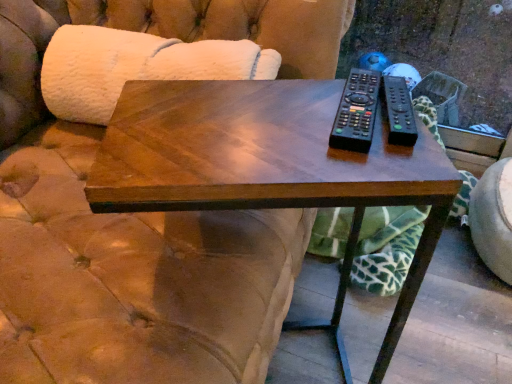
In order to face shiny wood coffee table at center, should I rotate leftwards or rightwards?

A 1.534 degree turn to the right will do.

Where is `black plastic remote at right, marked as the second remote in a left-to-right arrangement`? The image size is (512, 384). black plastic remote at right, marked as the second remote in a left-to-right arrangement is located at coordinates (399, 111).

Where is `shiny wood coffee table at center`? This screenshot has width=512, height=384. shiny wood coffee table at center is located at coordinates (267, 168).

Does black plastic remote at right, marked as the second remote in a left-to-right arrangement, turn towards shiny wood coffee table at center?

No, black plastic remote at right, marked as the second remote in a left-to-right arrangement, is not aimed at shiny wood coffee table at center.

Considering the positions of objects black plastic remote at right, the first remote viewed from the right, and shiny wood coffee table at center in the image provided, who is in front, black plastic remote at right, the first remote viewed from the right, or shiny wood coffee table at center?

shiny wood coffee table at center.

Who is taller, black plastic remote at right, marked as the second remote in a left-to-right arrangement, or shiny wood coffee table at center?

Standing taller between the two is shiny wood coffee table at center.

From the image's perspective, is black plastic remote at right, the first remote viewed from the right, above or below shiny wood coffee table at center?

Based on their image positions, black plastic remote at right, the first remote viewed from the right, is located above shiny wood coffee table at center.

At what (x,y) coordinates should I click in order to perform the action: click on couch located behind the black plastic remote at right, marked as the second remote in a left-to-right arrangement. Please return your answer as a coordinate pair (x, y). Looking at the image, I should click on (164, 36).

Is point (188, 30) positioned before point (385, 99)?

No, (188, 30) is further to viewer.

Between white fluffy couch at upper left and black plastic remote at right, marked as the second remote in a left-to-right arrangement, which one has less height?

With less height is black plastic remote at right, marked as the second remote in a left-to-right arrangement.

Does white fluffy couch at upper left have a lesser width compared to black plastic remote at right, the first remote viewed from the right?

No, white fluffy couch at upper left is not thinner than black plastic remote at right, the first remote viewed from the right.

From the image's perspective, is shiny wood coffee table at center above white fluffy couch at upper left?

No.

Would you consider shiny wood coffee table at center to be distant from white fluffy couch at upper left?

They are positioned close to each other.

Which is correct: shiny wood coffee table at center is inside white fluffy couch at upper left, or outside of it?

shiny wood coffee table at center lies outside white fluffy couch at upper left.

Does point (29, 91) come closer to viewer compared to point (202, 83)?

No.

Considering the relative sizes of white fluffy couch at upper left and shiny wood coffee table at center in the image provided, is white fluffy couch at upper left shorter than shiny wood coffee table at center?

Yes, white fluffy couch at upper left is shorter than shiny wood coffee table at center.

Is white fluffy couch at upper left in front of or behind shiny wood coffee table at center in the image?

Visually, white fluffy couch at upper left is located behind shiny wood coffee table at center.

Is white fluffy couch at upper left next to shiny wood coffee table at center and touching it?

They are not placed beside each other.

From the image's perspective, who appears lower, black plastic remote at upper right, positioned as the second remote in right-to-left order, or white fluffy couch at upper left?

black plastic remote at upper right, positioned as the second remote in right-to-left order, is shown below in the image.

Consider the image. Considering the relative sizes of black plastic remote at upper right, the 1th remote from the left, and white fluffy couch at upper left in the image provided, is black plastic remote at upper right, the 1th remote from the left, smaller than white fluffy couch at upper left?

Yes.

Which object is more forward, black plastic remote at upper right, positioned as the second remote in right-to-left order, or white fluffy couch at upper left?

Positioned in front is black plastic remote at upper right, positioned as the second remote in right-to-left order.

From a real-world perspective, is black plastic remote at upper right, positioned as the second remote in right-to-left order, positioned above or below white fluffy couch at upper left?

Clearly, from a real-world perspective, black plastic remote at upper right, positioned as the second remote in right-to-left order, is above white fluffy couch at upper left.

Is black plastic remote at right, marked as the second remote in a left-to-right arrangement, oriented away from black plastic remote at upper right, the 1th remote from the left?

black plastic remote at right, marked as the second remote in a left-to-right arrangement, is not turned away from black plastic remote at upper right, the 1th remote from the left.

Considering the points (383, 83) and (348, 109), which point is in front, point (383, 83) or point (348, 109)?

The point (348, 109) is closer.

From a real-world perspective, which object stands above the other?

From a 3D spatial view, black plastic remote at right, the first remote viewed from the right, is above.

Would you say black plastic remote at right, the first remote viewed from the right, is a long distance from black plastic remote at upper right, positioned as the second remote in right-to-left order?

No, black plastic remote at right, the first remote viewed from the right, is not far away from black plastic remote at upper right, positioned as the second remote in right-to-left order.

Is black plastic remote at upper right, positioned as the second remote in right-to-left order, spatially inside shiny wood coffee table at center, or outside of it?

black plastic remote at upper right, positioned as the second remote in right-to-left order, is located beyond the bounds of shiny wood coffee table at center.

Considering the sizes of objects black plastic remote at upper right, positioned as the second remote in right-to-left order, and shiny wood coffee table at center in the image provided, who is taller, black plastic remote at upper right, positioned as the second remote in right-to-left order, or shiny wood coffee table at center?

shiny wood coffee table at center is taller.

Considering the positions of objects black plastic remote at upper right, positioned as the second remote in right-to-left order, and shiny wood coffee table at center in the image provided, who is in front, black plastic remote at upper right, positioned as the second remote in right-to-left order, or shiny wood coffee table at center?

shiny wood coffee table at center.

Which remote is the 2nd one when counting from the back of the shiny wood coffee table at center? Please provide its 2D coordinates.

[(399, 111)]

Where is `the 2nd remote positioned below the white fluffy couch at upper left (from the image's perspective)`? Image resolution: width=512 pixels, height=384 pixels. the 2nd remote positioned below the white fluffy couch at upper left (from the image's perspective) is located at coordinates point(399,111).

Considering their positions, is black plastic remote at right, marked as the second remote in a left-to-right arrangement, positioned further to black plastic remote at upper right, the 1th remote from the left, than white fluffy couch at upper left?

white fluffy couch at upper left.

When comparing their distances from white fluffy couch at upper left, does black plastic remote at right, the first remote viewed from the right, or black plastic remote at upper right, positioned as the second remote in right-to-left order, seem further?

Among the two, black plastic remote at right, the first remote viewed from the right, is located further to white fluffy couch at upper left.

Consider the image. When comparing their distances from black plastic remote at right, the first remote viewed from the right, does white fluffy couch at upper left or shiny wood coffee table at center seem further?

white fluffy couch at upper left is further to black plastic remote at right, the first remote viewed from the right.

When comparing their distances from black plastic remote at right, marked as the second remote in a left-to-right arrangement, does shiny wood coffee table at center or white fluffy couch at upper left seem closer?

shiny wood coffee table at center.

Estimate the real-world distances between objects in this image. Which object is further from shiny wood coffee table at center, black plastic remote at right, marked as the second remote in a left-to-right arrangement, or white fluffy couch at upper left?

Among the two, white fluffy couch at upper left is located further to shiny wood coffee table at center.

Which object lies nearer to the anchor point black plastic remote at upper right, positioned as the second remote in right-to-left order, shiny wood coffee table at center or black plastic remote at right, marked as the second remote in a left-to-right arrangement?

black plastic remote at right, marked as the second remote in a left-to-right arrangement, is positioned closer to the anchor black plastic remote at upper right, positioned as the second remote in right-to-left order.

From the image, which object appears to be farther from black plastic remote at upper right, the 1th remote from the left, shiny wood coffee table at center or white fluffy couch at upper left?

white fluffy couch at upper left.

Which object lies nearer to the anchor point black plastic remote at right, marked as the second remote in a left-to-right arrangement, shiny wood coffee table at center or black plastic remote at upper right, the 1th remote from the left?

black plastic remote at upper right, the 1th remote from the left, is positioned closer to the anchor black plastic remote at right, marked as the second remote in a left-to-right arrangement.

This screenshot has width=512, height=384. What are the coordinates of `remote situated between white fluffy couch at upper left and black plastic remote at right, marked as the second remote in a left-to-right arrangement, from left to right` in the screenshot? It's located at (356, 112).

This screenshot has width=512, height=384. Find the location of `remote that lies between black plastic remote at upper right, positioned as the second remote in right-to-left order, and shiny wood coffee table at center from top to bottom`. remote that lies between black plastic remote at upper right, positioned as the second remote in right-to-left order, and shiny wood coffee table at center from top to bottom is located at coordinates (399, 111).